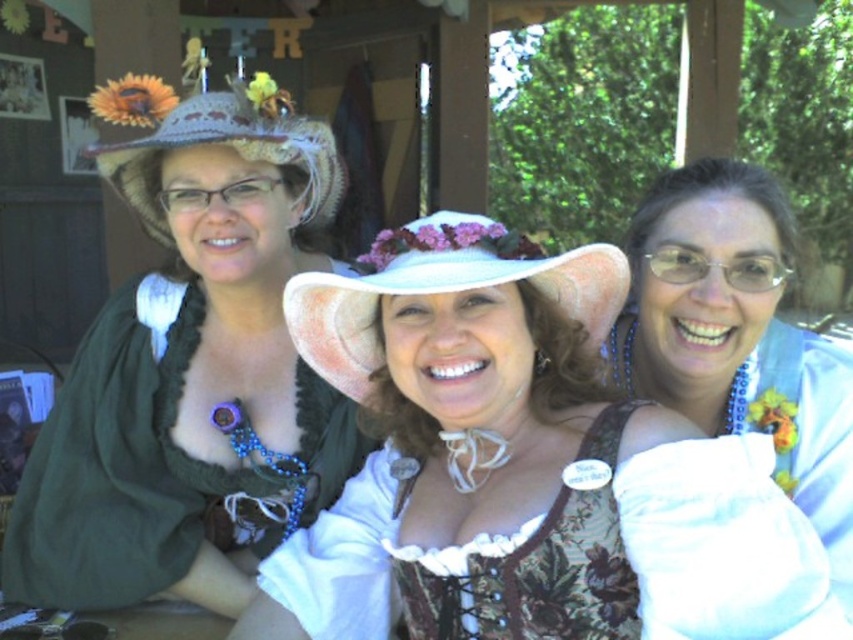
Question: Among these objects, which one is farthest from the camera?

Choices:
 (A) white fabric hat at center
 (B) white fabric dress at center

Answer: (A)

Question: Is matte green dress at upper left thinner than crochethat at left?

Choices:
 (A) no
 (B) yes

Answer: (B)

Question: Is white fabric hat at center to the left of crochethat at left from the viewer's perspective?

Choices:
 (A) no
 (B) yes

Answer: (A)

Question: In this image, where is matte green dress at upper left located relative to crochethat at left?

Choices:
 (A) below
 (B) above

Answer: (A)

Question: Which is nearer to the matte green dress at upper left?

Choices:
 (A) white fabric dress at center
 (B) crochethat at left

Answer: (B)

Question: Estimate the real-world distances between objects in this image. Which object is farther from the white satin dress at center?

Choices:
 (A) matte green dress at upper left
 (B) white fabric hat at center
 (C) white fabric dress at center
 (D) crochethat at left

Answer: (D)